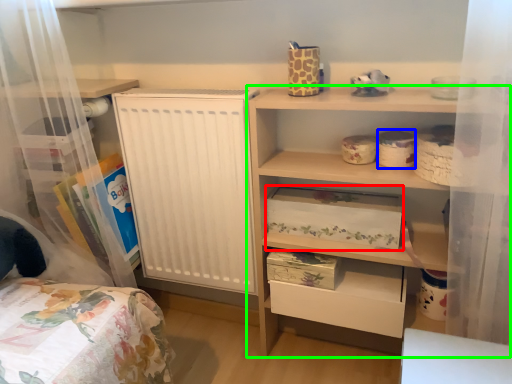
Question: Based on their relative distances, which object is farther from storage box (highlighted by a red box)? Choose from storage box (highlighted by a blue box) and shelf (highlighted by a green box).

Choices:
 (A) storage box
 (B) shelf

Answer: (A)